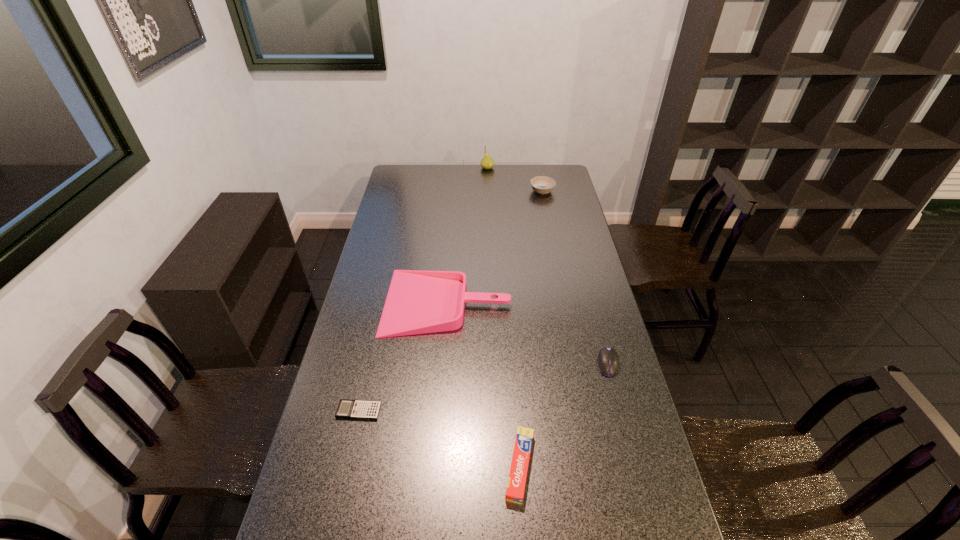
Locate an element on the screen. bowl situated at the right edge is located at coordinates (541, 184).

What are the coordinates of `computer mouse that is at the right edge` in the screenshot? It's located at (608, 360).

Where is `object that is at the far right corner`? object that is at the far right corner is located at coordinates click(541, 184).

At what (x,y) coordinates should I click in order to perform the action: click on vacant space at the far edge of the desktop. Please return your answer as a coordinate pair (x, y). The height and width of the screenshot is (540, 960). Looking at the image, I should click on (453, 174).

Where is `free space at the left edge of the desktop`? free space at the left edge of the desktop is located at coordinates (378, 396).

I want to click on vacant space at the right edge, so click(564, 244).

Where is `vacant space at the far left corner of the desktop`? Image resolution: width=960 pixels, height=540 pixels. vacant space at the far left corner of the desktop is located at coordinates (415, 174).

At what (x,y) coordinates should I click in order to perform the action: click on free space at the far right corner of the desktop. Please return your answer as a coordinate pair (x, y). This screenshot has width=960, height=540. Looking at the image, I should click on (567, 181).

Locate an element on the screen. Image resolution: width=960 pixels, height=540 pixels. vacant space that's between the nearest object and the bowl is located at coordinates click(531, 329).

At what (x,y) coordinates should I click in order to perform the action: click on vacant area between the second farthest object and the fourth farthest object. Please return your answer as a coordinate pair (x, y). Image resolution: width=960 pixels, height=540 pixels. Looking at the image, I should click on (575, 278).